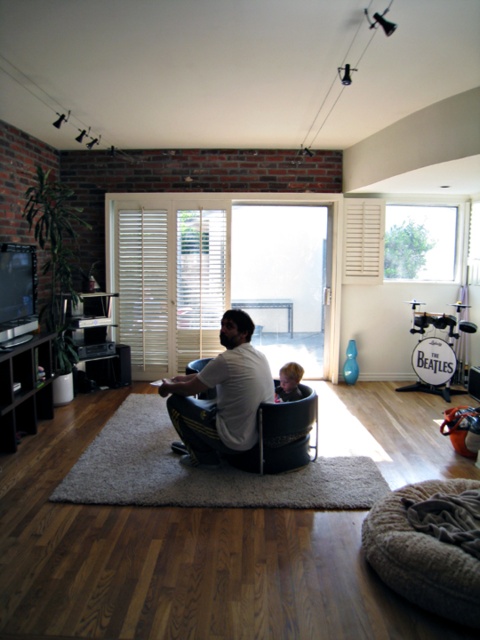
Does beige textured bean bag at lower right have a smaller size compared to smooth brown hair at lower center?

Actually, beige textured bean bag at lower right might be larger than smooth brown hair at lower center.

Between point (466, 579) and point (295, 400), which one is positioned in front?

Point (466, 579) is in front.

Who is more forward, (475, 612) or (287, 380)?

Point (475, 612) is more forward.

At what (x,y) coordinates should I click in order to perform the action: click on beige textured bean bag at lower right. Please return your answer as a coordinate pair (x, y). Image resolution: width=480 pixels, height=640 pixels. Looking at the image, I should click on (429, 547).

Is white cotton shirt at center to the right of smooth brown hair at lower center from the viewer's perspective?

No, white cotton shirt at center is not to the right of smooth brown hair at lower center.

Does white cotton shirt at center have a greater width compared to smooth brown hair at lower center?

Yes.

Who is more distant from viewer, (x=247, y=436) or (x=286, y=392)?

The point (x=286, y=392) is more distant.

Locate an element on the screen. This screenshot has width=480, height=640. white cotton shirt at center is located at coordinates (222, 396).

Is beige textured bean bag at lower right behind white cotton shirt at center?

No, beige textured bean bag at lower right is closer to the viewer.

Is beige textured bean bag at lower right smaller than white cotton shirt at center?

Yes, beige textured bean bag at lower right is smaller than white cotton shirt at center.

Where is `beige textured bean bag at lower right`? The height and width of the screenshot is (640, 480). beige textured bean bag at lower right is located at coordinates (429, 547).